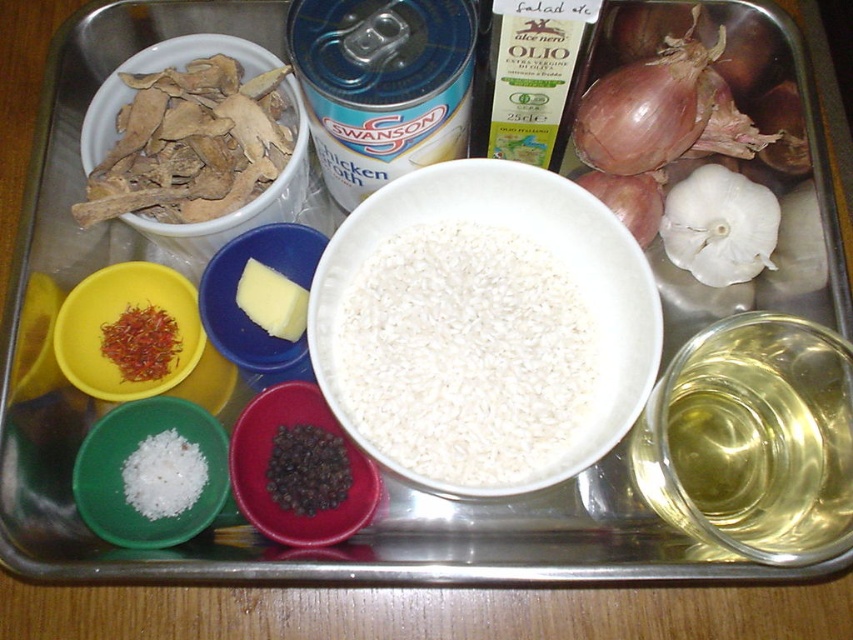
Question: Which object is closer to the camera taking this photo?

Choices:
 (A) white matte salt at center left
 (B) white matte garlic at upper right

Answer: (A)

Question: Is brown matte onion at upper right closer to camera compared to white matte rice at center?

Choices:
 (A) yes
 (B) no

Answer: (A)

Question: Where is white matte bowl at center located in relation to dark red plastic bowl at center in the image?

Choices:
 (A) left
 (B) right

Answer: (B)

Question: Which point is farther from the camera taking this photo?

Choices:
 (A) (653, 192)
 (B) (117, 442)
 (C) (224, 288)
 (D) (544, 237)

Answer: (A)

Question: Estimate the real-world distances between objects in this image. Which object is farther from the white matte onion at upper right?

Choices:
 (A) white matte salt at center left
 (B) yellow creamy cheese at center
 (C) yellow matte butter at center
 (D) brown matte onion at upper right

Answer: (A)

Question: Is brown matte onion at upper right above white matte garlic at upper right?

Choices:
 (A) no
 (B) yes

Answer: (B)